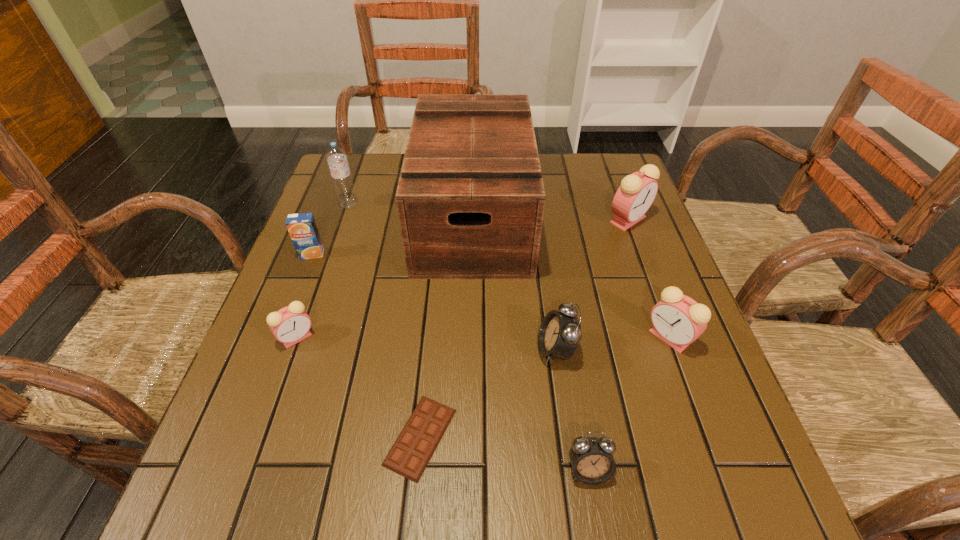
You are a GUI agent. You are given a task and a screenshot of the screen. Output one action in this format:
    pyautogui.click(x=<x>, y=<y>)
    Task: Click on the smaller white alarm clock
    This screenshot has height=540, width=960.
    Given the screenshot: What is the action you would take?
    pyautogui.click(x=592, y=461)

The image size is (960, 540). In order to click on chocolate bar in this screenshot , I will do [x=409, y=456].

Identify the location of vacant space located 0.200m on the left of the tallest object. (343, 217).

Identify the location of blank space located 0.240m on the front of the second tallest object. This screenshot has height=540, width=960. (325, 273).

Find the location of a particular element. This screenshot has height=540, width=960. vacant area located 0.110m on the face of the biggest pink alarm clock is located at coordinates (644, 264).

Locate an element on the screen. This screenshot has width=960, height=540. vacant space situated on the face of the second biggest pink alarm clock is located at coordinates (530, 337).

Identify the location of vacant region located on the face of the second biggest pink alarm clock. This screenshot has height=540, width=960. (618, 337).

Where is `free point located 0.110m on the face of the second biggest pink alarm clock`? This screenshot has height=540, width=960. free point located 0.110m on the face of the second biggest pink alarm clock is located at coordinates (593, 337).

Identify the location of free space located 0.380m on the face of the bigger white alarm clock. [347, 350].

Find the location of a particular element. vacant space located 0.280m on the face of the bigger white alarm clock is located at coordinates (396, 350).